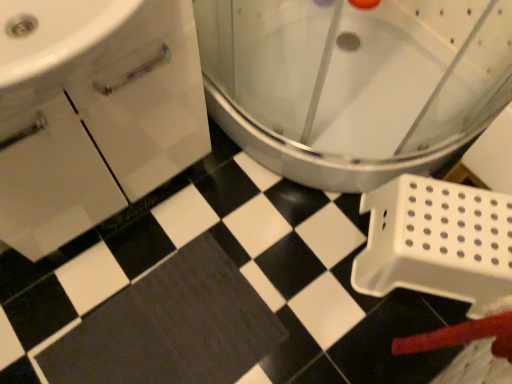
Locate an element on the screen. free spot behind black matte bath mat at center is located at coordinates (198, 222).